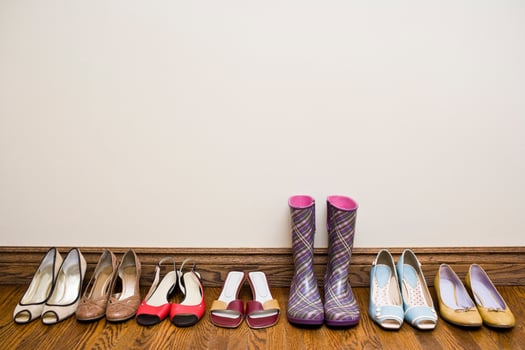
This screenshot has width=525, height=350. What are the coordinates of `pairs of shoes` in the screenshot? It's located at (36, 306), (106, 286), (169, 298), (245, 311), (315, 275), (386, 306), (471, 285).